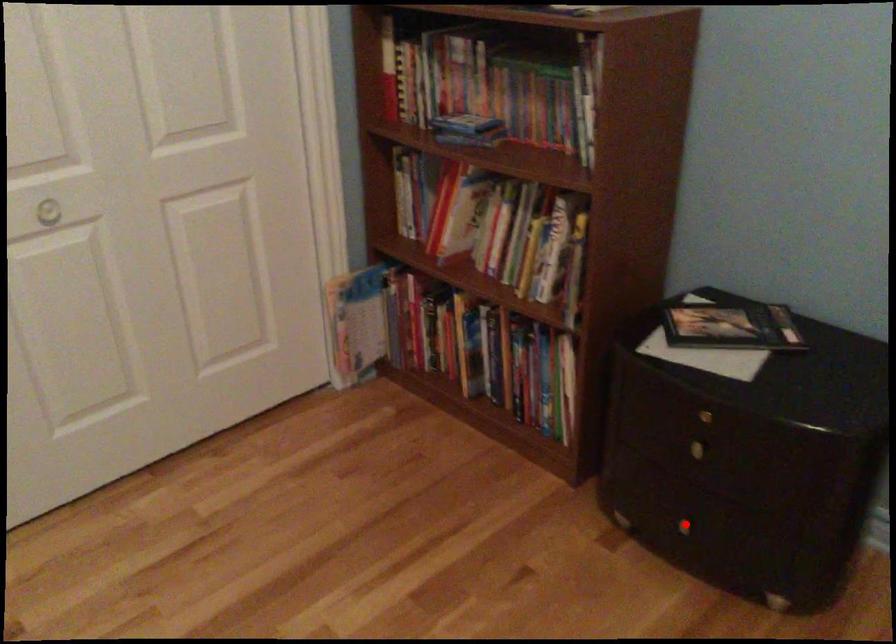
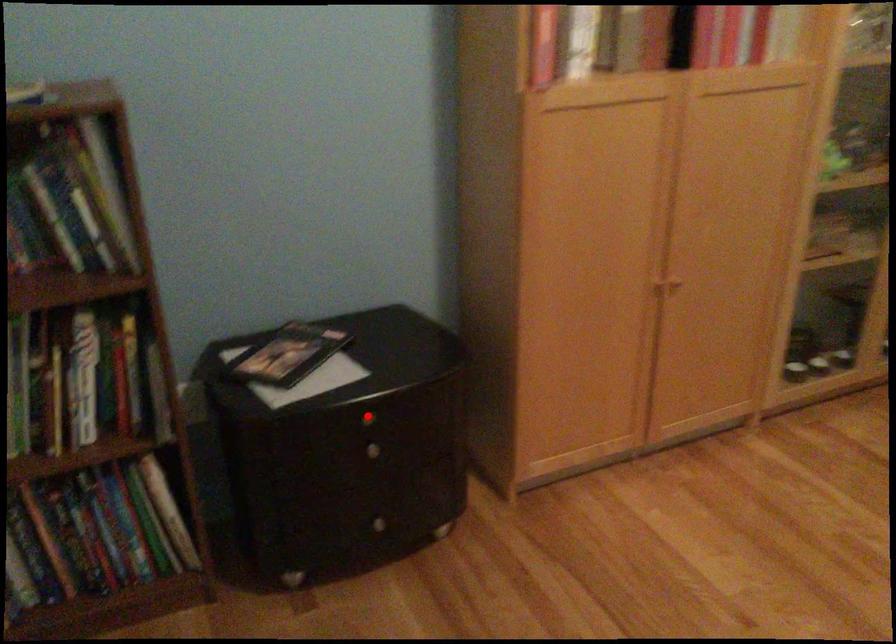
I am providing you with two images of the same scene from different viewpoints. A red point is marked on the first image and another point is marked on the second image. Is the marked point in image1 the same physical position as the marked point in image2?

No